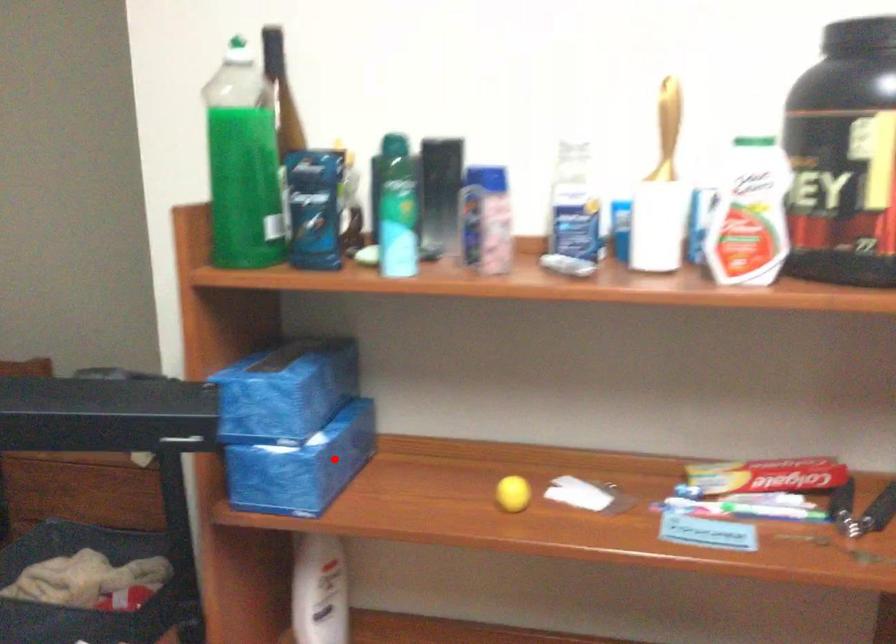
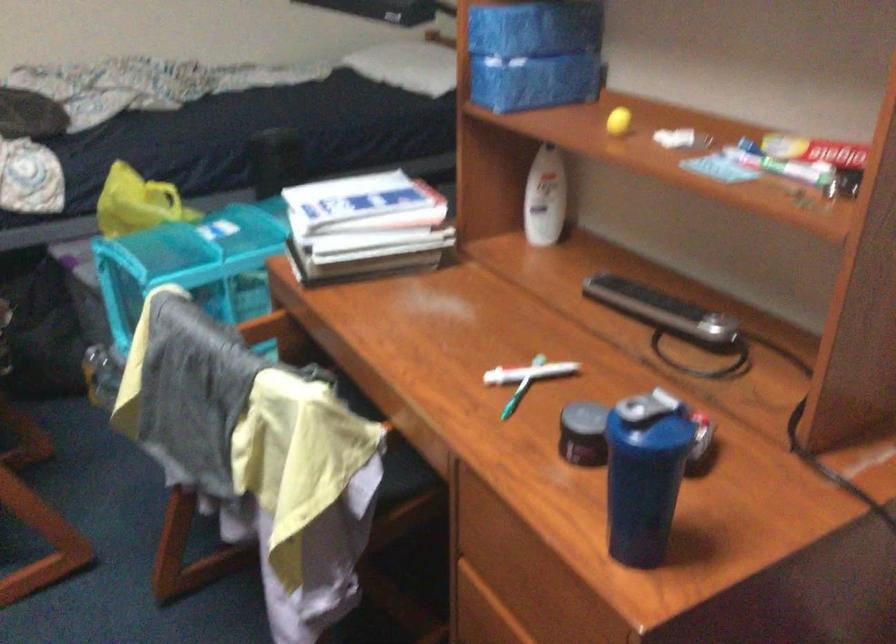
Question: I am providing you with two images of the same scene from different viewpoints. Image1 has a red point marked. In image2, the corresponding 3D location appears at what relative position? Reply with the corresponding letter.

Choices:
 (A) Closer
 (B) Farther

Answer: (B)